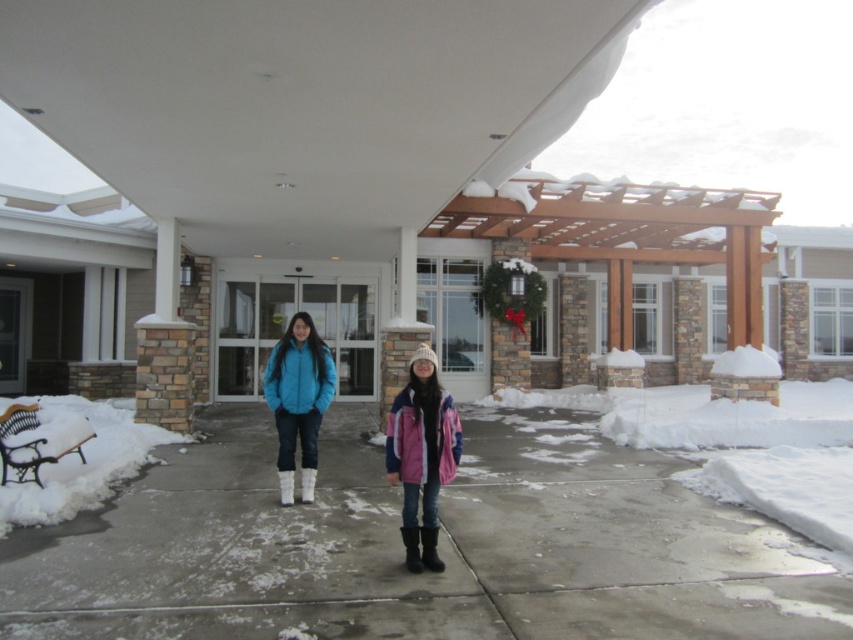
Question: Is concrete pavement at center to the right of pink fleece jacket at center from the viewer's perspective?

Choices:
 (A) no
 (B) yes

Answer: (B)

Question: Does concrete pavement at center appear under matte blue jacket at center?

Choices:
 (A) yes
 (B) no

Answer: (A)

Question: Which object appears closest to the camera in this image?

Choices:
 (A) pink fleece jacket at center
 (B) concrete pavement at center

Answer: (B)

Question: Is concrete pavement at center thinner than matte blue jacket at center?

Choices:
 (A) no
 (B) yes

Answer: (A)

Question: Which point appears closest to the camera in this image?

Choices:
 (A) (314, 426)
 (B) (482, 420)

Answer: (A)

Question: Which object is the closest to the matte blue jacket at center?

Choices:
 (A) concrete pavement at center
 (B) pink fleece jacket at center

Answer: (B)